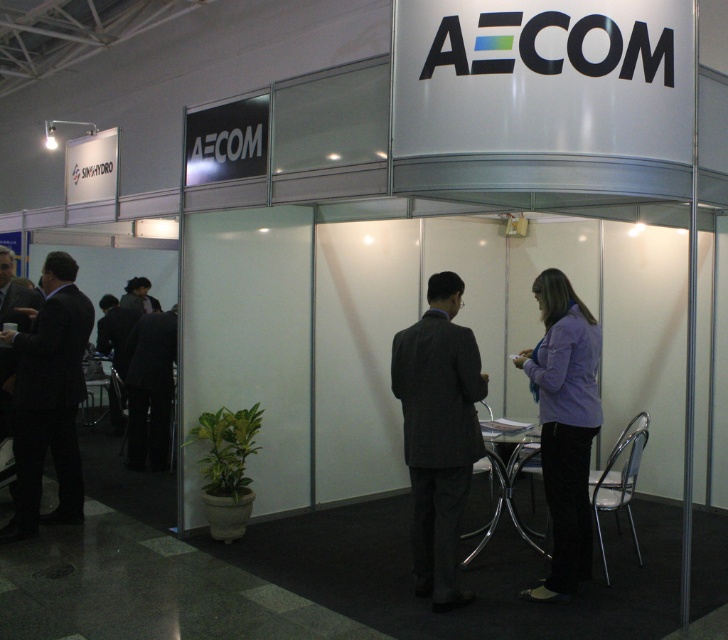
Question: Which object appears closest to the camera in this image?

Choices:
 (A) dark gray suit at center
 (B) black suit at left

Answer: (A)

Question: Which of the following is the closest to the observer?

Choices:
 (A) tap(7, 355)
 (B) tap(577, 541)
 (C) tap(389, 387)
 (D) tap(75, 342)

Answer: (B)

Question: Is purple fabric shirt at center further to the viewer compared to black suit at left?

Choices:
 (A) yes
 (B) no

Answer: (B)

Question: In this image, where is black suit at left located relative to dark suit at left?

Choices:
 (A) above
 (B) below

Answer: (B)

Question: Which point is closer to the camera?

Choices:
 (A) purple fabric shirt at center
 (B) dark gray suit at center
 (C) black suit at left

Answer: (B)

Question: Is purple fabric shirt at center smaller than dark suit at left?

Choices:
 (A) yes
 (B) no

Answer: (B)